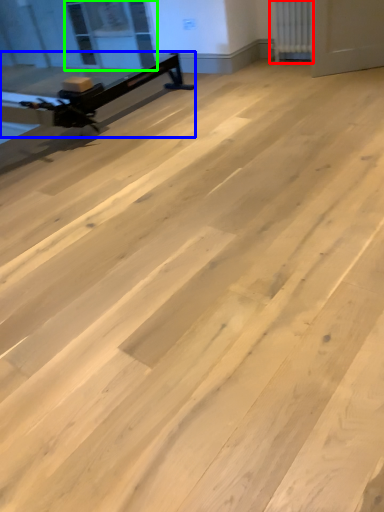
Question: Which object is positioned farthest from radiator (highlighted by a red box)? Select from furniture (highlighted by a blue box) and window screen (highlighted by a green box).

Choices:
 (A) furniture
 (B) window screen

Answer: (B)